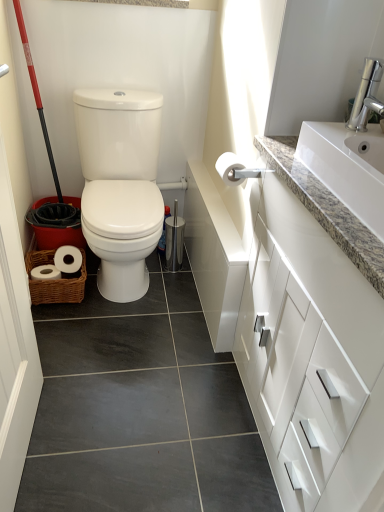
Question: Should I look upward or downward to see white matte toilet paper at upper right?

Choices:
 (A) down
 (B) up

Answer: (B)

Question: From a real-world perspective, is white matte toilet paper at upper right physically below white glossy cabinet at upper right?

Choices:
 (A) no
 (B) yes

Answer: (A)

Question: Does white matte toilet paper at upper right have a greater height compared to white glossy cabinet at upper right?

Choices:
 (A) no
 (B) yes

Answer: (A)

Question: From a real-world perspective, is white matte toilet paper at upper right on white glossy cabinet at upper right?

Choices:
 (A) yes
 (B) no

Answer: (A)

Question: Is white matte toilet paper at upper right not inside white glossy cabinet at upper right?

Choices:
 (A) yes
 (B) no

Answer: (A)

Question: Does white matte toilet paper at upper right have a lesser width compared to white glossy cabinet at upper right?

Choices:
 (A) yes
 (B) no

Answer: (A)

Question: Is white matte toilet paper at upper right at the right side of white glossy cabinet at upper right?

Choices:
 (A) no
 (B) yes

Answer: (A)

Question: From a real-world perspective, is white granite sink at upper right positioned under white glossy cabinet at upper right based on gravity?

Choices:
 (A) no
 (B) yes

Answer: (A)

Question: Is white glossy cabinet at upper right completely or partially inside white granite sink at upper right?

Choices:
 (A) yes
 (B) no

Answer: (B)

Question: Is white granite sink at upper right taller than white glossy cabinet at upper right?

Choices:
 (A) no
 (B) yes

Answer: (A)

Question: Could you tell me if white granite sink at upper right is turned towards white glossy cabinet at upper right?

Choices:
 (A) no
 (B) yes

Answer: (A)

Question: Does white granite sink at upper right touch white glossy cabinet at upper right?

Choices:
 (A) yes
 (B) no

Answer: (B)

Question: Can you confirm if white granite sink at upper right is wider than white glossy cabinet at upper right?

Choices:
 (A) no
 (B) yes

Answer: (A)

Question: Would you say white glossy cabinet at upper right is a long distance from white granite sink at upper right?

Choices:
 (A) yes
 (B) no

Answer: (B)